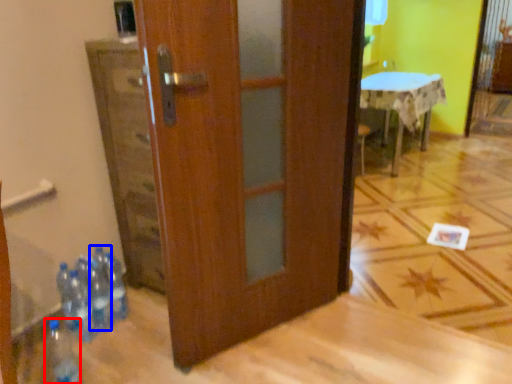
Question: Which object is closer to the camera taking this photo, bottle (highlighted by a red box) or bottle (highlighted by a blue box)?

Choices:
 (A) bottle
 (B) bottle

Answer: (A)